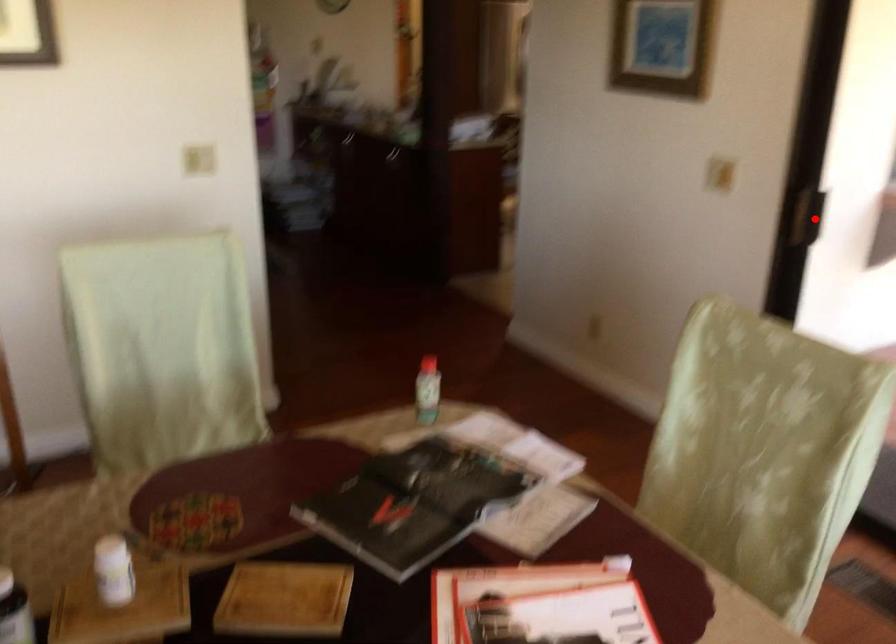
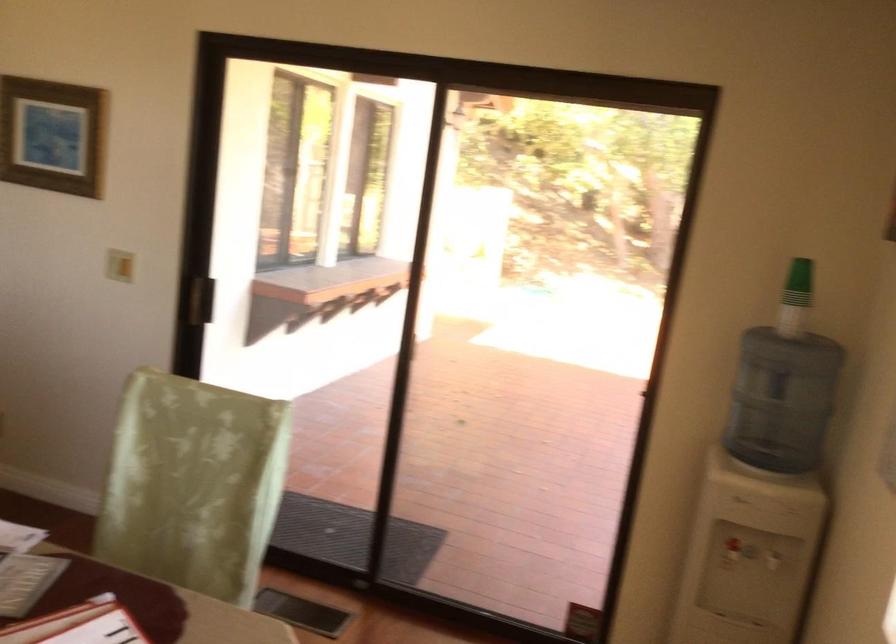
Locate, in the second image, the point that corresponds to the highlighted location in the first image.

(201, 299)